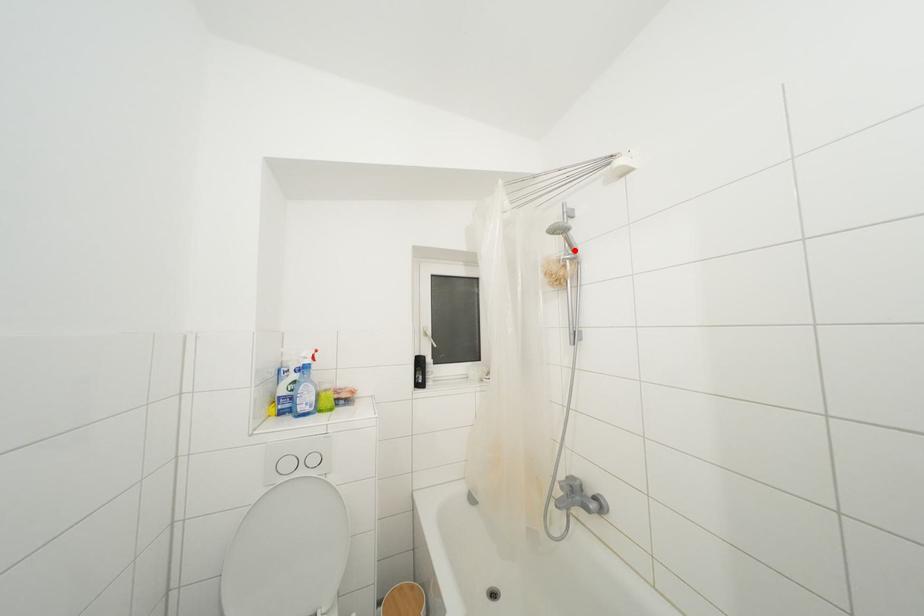
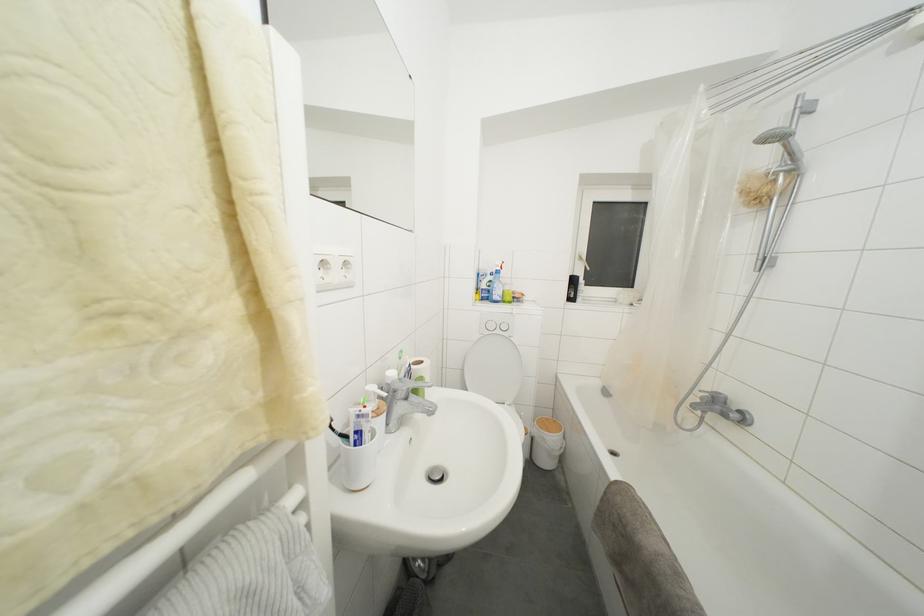
In the second image, find the point that corresponds to the highlighted location in the first image.

(796, 159)